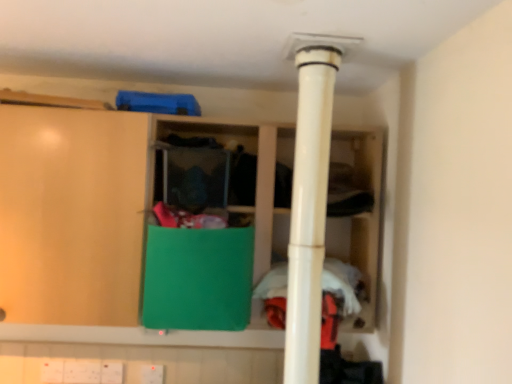
Find the location of a particular element. Image resolution: width=512 pixels, height=384 pixels. blank space situated above white plastic pipe at center (from a real-world perspective) is located at coordinates (315, 53).